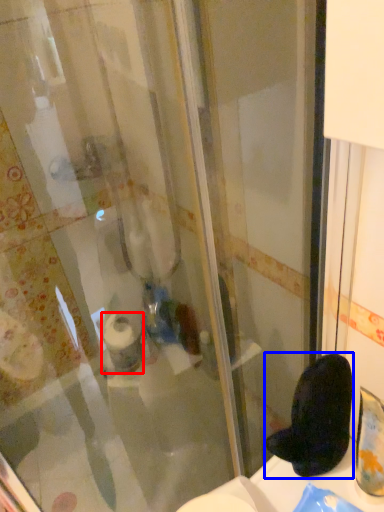
Question: Which object appears closest to the camera in this image, toilet paper (highlighted by a red box) or footwear (highlighted by a blue box)?

Choices:
 (A) toilet paper
 (B) footwear

Answer: (B)